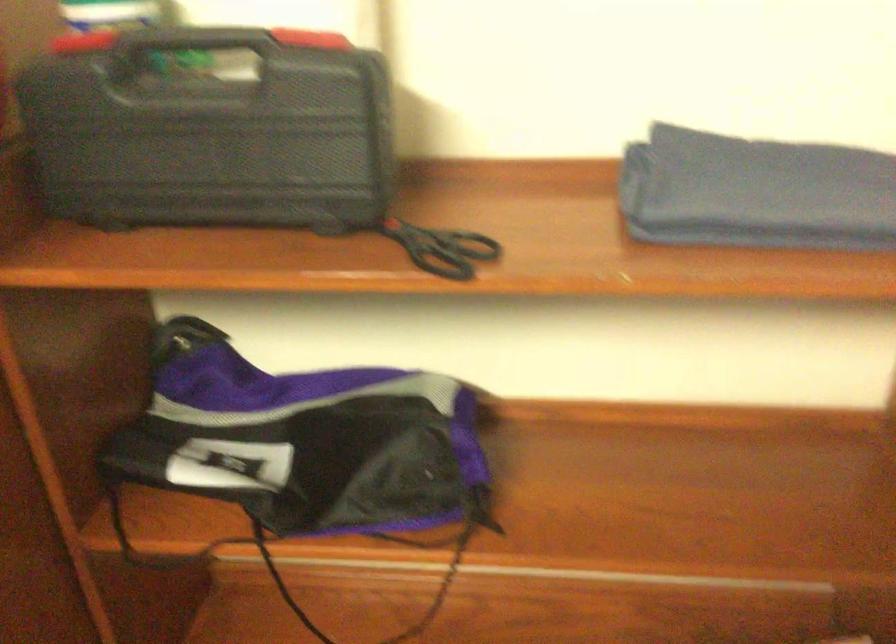
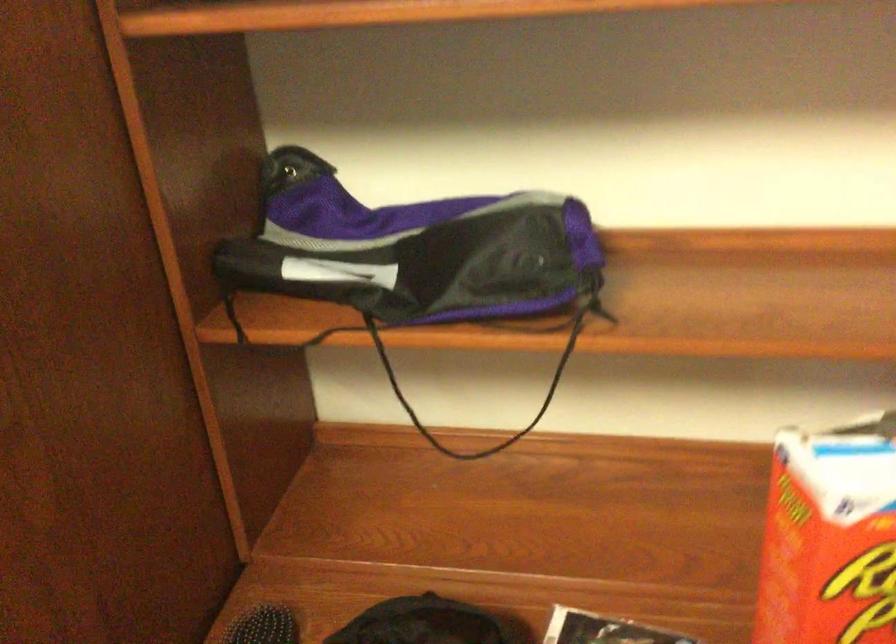
Question: The images are taken continuously from a first-person perspective. In which direction is your viewpoint rotating?

Choices:
 (A) Left
 (B) Right
 (C) Up
 (D) Down

Answer: (A)